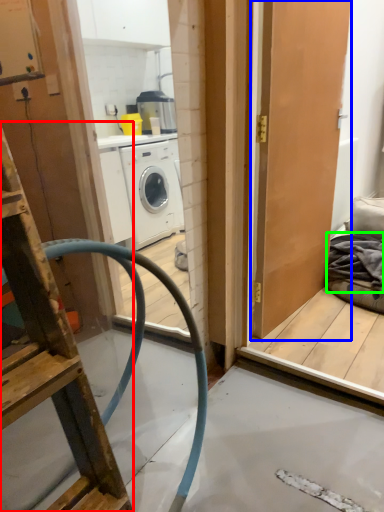
Question: Based on their relative distances, which object is farther from ladder (highlighted by a red box)? Choose from door (highlighted by a blue box) and material (highlighted by a green box).

Choices:
 (A) door
 (B) material

Answer: (B)